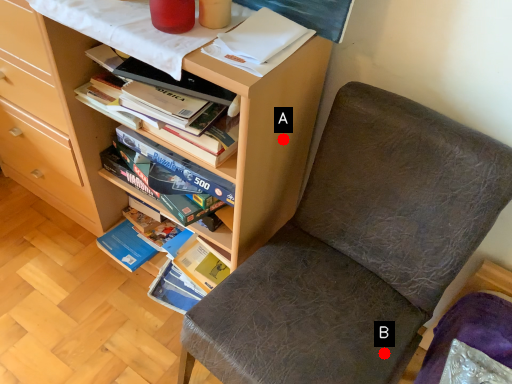
Question: Two points are circled on the image, labeled by A and B beside each circle. Which point is farther from the camera taking this photo?

Choices:
 (A) A is further
 (B) B is further

Answer: (A)